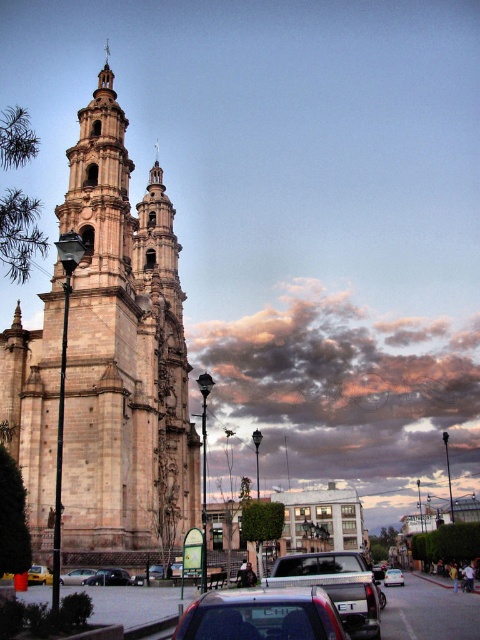
The image size is (480, 640). In order to click on matte silver sedan at lower center in this screenshot , I will do `click(261, 616)`.

Does matte silver sedan at lower center appear on the right side of yellow matte taxi at lower left?

Indeed, matte silver sedan at lower center is positioned on the right side of yellow matte taxi at lower left.

Between point (189, 634) and point (39, 564), which one is positioned behind?

Point (39, 564)

Where is `matte silver sedan at lower center`? matte silver sedan at lower center is located at coordinates (261, 616).

Does matte silver sedan at center appear on the right side of yellow matte taxi at lower left?

Indeed, matte silver sedan at center is positioned on the right side of yellow matte taxi at lower left.

Between matte silver sedan at center and yellow matte taxi at lower left, which one is positioned higher?

Positioned higher is yellow matte taxi at lower left.

This screenshot has width=480, height=640. Identify the location of matte silver sedan at center. (76, 577).

Where is `beige stone tower at left`? The height and width of the screenshot is (640, 480). beige stone tower at left is located at coordinates (123, 352).

Is point (144, 492) behind point (402, 573)?

No, it is in front of (402, 573).

What are the coordinates of `beige stone tower at left` in the screenshot? It's located at (123, 352).